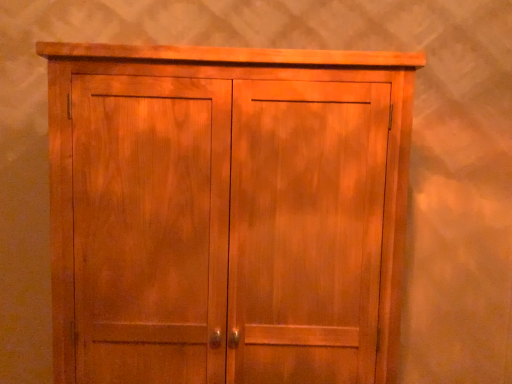
Where is `matte wood cupboard at center`? matte wood cupboard at center is located at coordinates (227, 213).

The height and width of the screenshot is (384, 512). What do you see at coordinates (227, 213) in the screenshot?
I see `matte wood cupboard at center` at bounding box center [227, 213].

The image size is (512, 384). I want to click on matte wood cupboard at center, so click(227, 213).